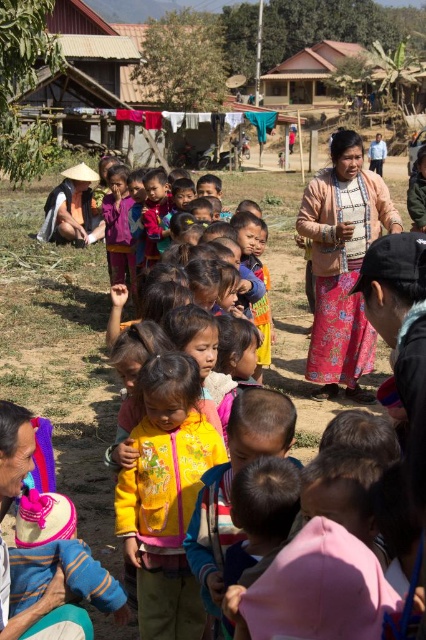
Between point (161, 144) and point (196, 440), which one is positioned behind?

The point (161, 144) is more distant.

Can you confirm if wooden hut at upper center is smaller than yellow fleece jacket at center?

Actually, wooden hut at upper center might be larger than yellow fleece jacket at center.

I want to click on wooden hut at upper center, so click(138, 68).